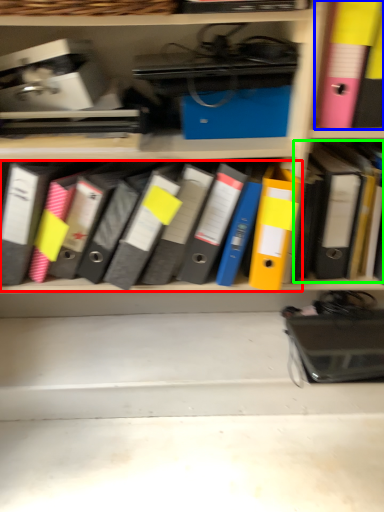
Question: Estimate the real-world distances between objects in this image. Which object is farther from notebook (highlighted by a red box), bin (highlighted by a blue box) or book (highlighted by a green box)?

Choices:
 (A) bin
 (B) book

Answer: (A)